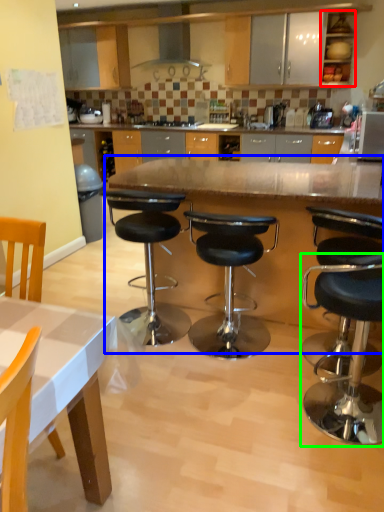
Question: Which object is the farthest from cabinetry (highlighted by a red box)? Choose among these: table (highlighted by a blue box) or stool (highlighted by a green box).

Choices:
 (A) table
 (B) stool

Answer: (B)